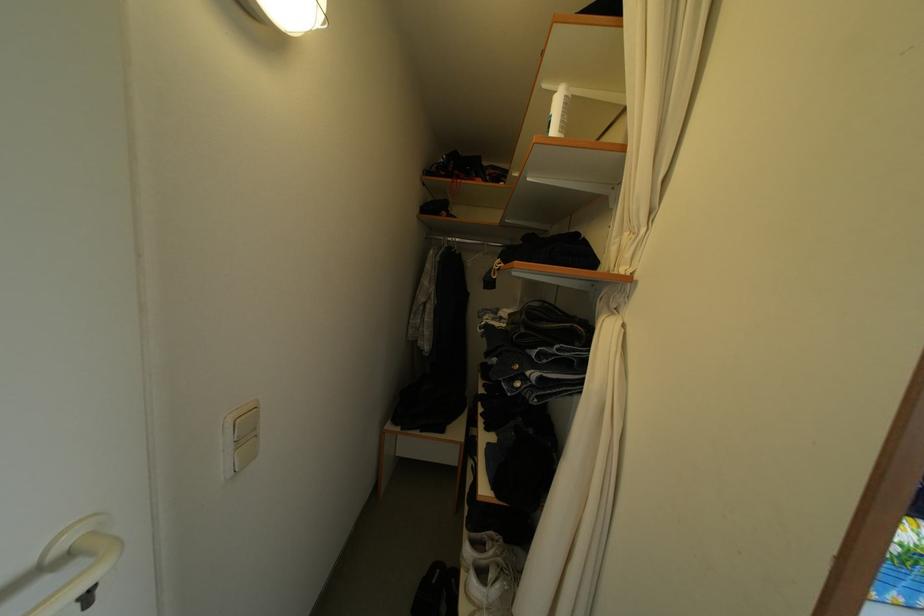
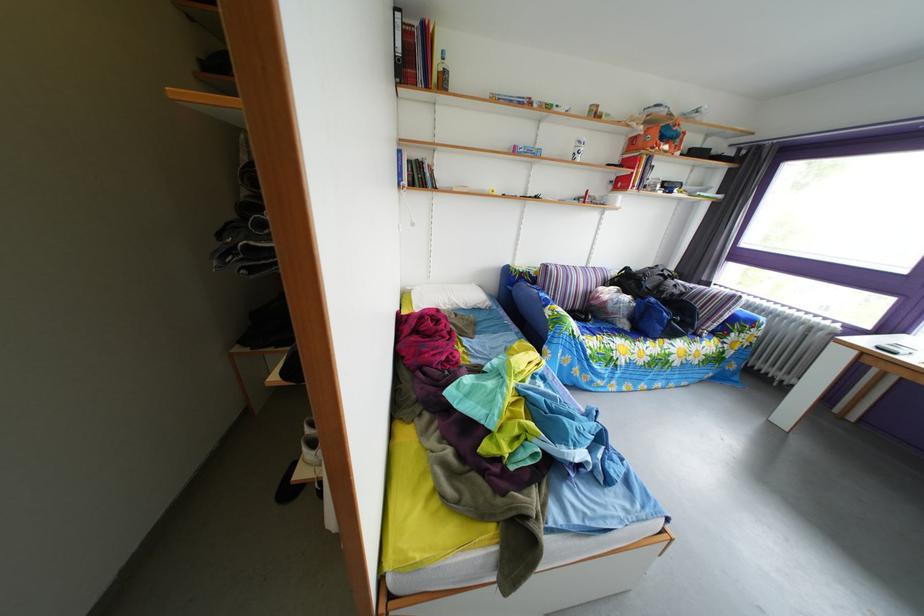
Question: In a continuous first-person perspective shot, in which direction is the camera moving?

Choices:
 (A) Left
 (B) Right
 (C) Forward
 (D) Backward

Answer: (B)